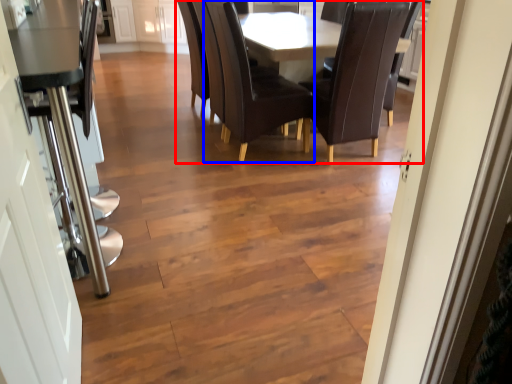
Question: Which object appears closest to the camera in this image, kitchen & dining room table (highlighted by a red box) or chair (highlighted by a blue box)?

Choices:
 (A) kitchen & dining room table
 (B) chair

Answer: (B)